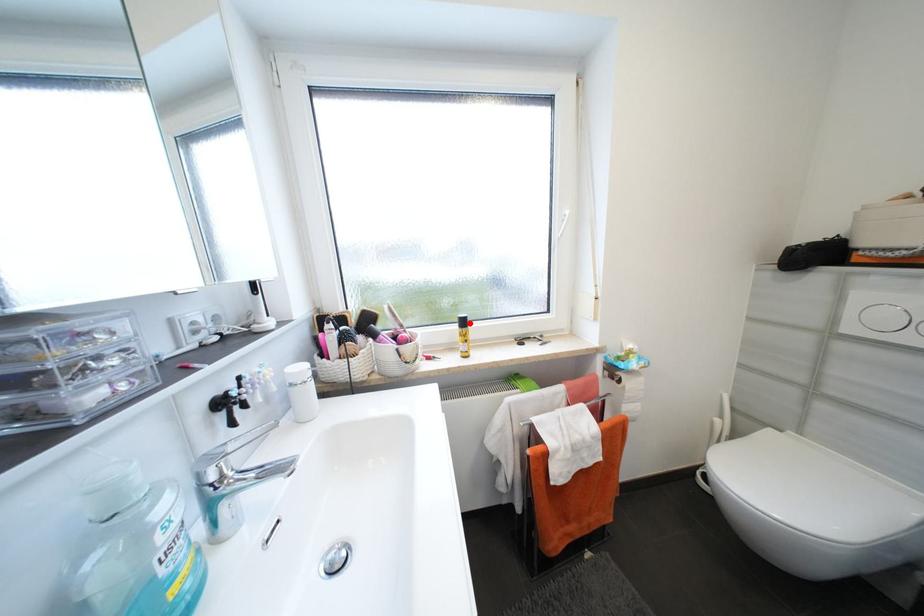
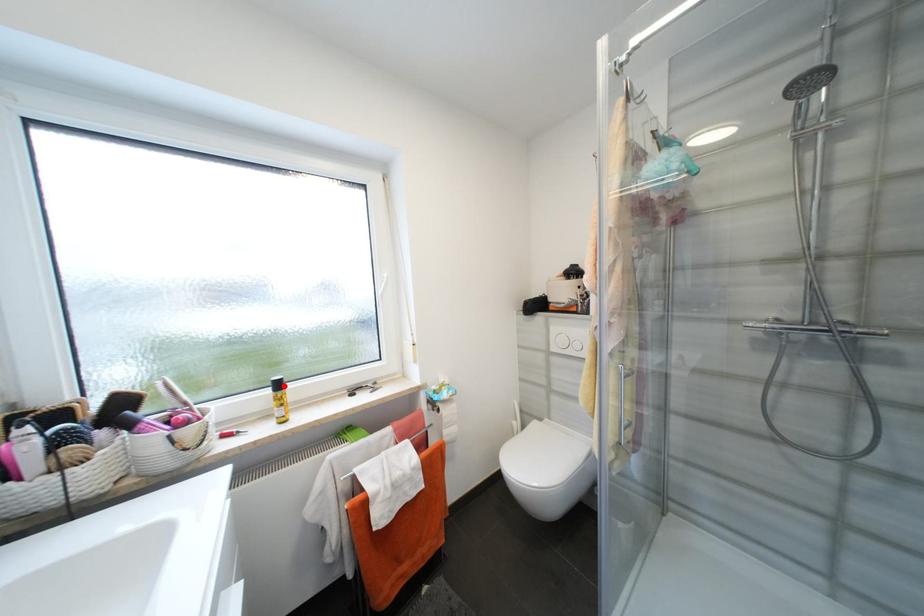
Looking at this image, I am providing you with two images of the same scene from different viewpoints. A red point is marked on the first image and another point is marked on the second image. Are the points marked in image1 and image2 representing the same 3D position?

Yes